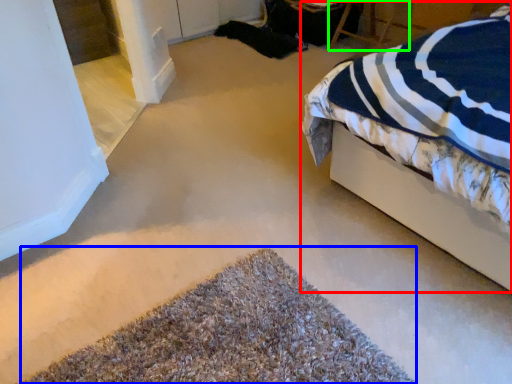
Question: Which object is positioned farthest from bed (highlighted by a red box)? Select from door (highlighted by a blue box) and chair (highlighted by a green box).

Choices:
 (A) door
 (B) chair

Answer: (B)